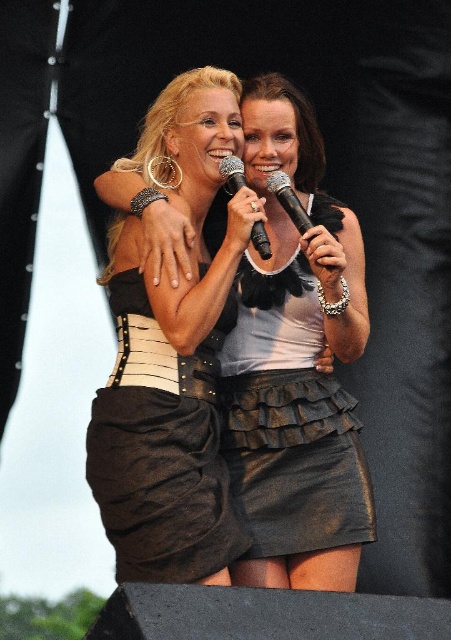
Question: Estimate the real-world distances between objects in this image. Which object is closer to the denim skirt at center?

Choices:
 (A) black metallic microphone at center
 (B) black plastic microphone at center

Answer: (B)

Question: Does denim skirt at center appear on the left side of black metallic microphone at center?

Choices:
 (A) yes
 (B) no

Answer: (B)

Question: Can you confirm if black leather skirt at center is wider than black metallic microphone at center?

Choices:
 (A) yes
 (B) no

Answer: (A)

Question: Which of the following is the closest to the observer?

Choices:
 (A) (113, 292)
 (B) (229, 173)

Answer: (A)

Question: Is matte black dress at center bigger than black leather skirt at center?

Choices:
 (A) no
 (B) yes

Answer: (A)

Question: Which point is farther to the camera?

Choices:
 (A) (280, 198)
 (B) (265, 248)
 (C) (312, 284)
 (D) (277, 577)

Answer: (C)